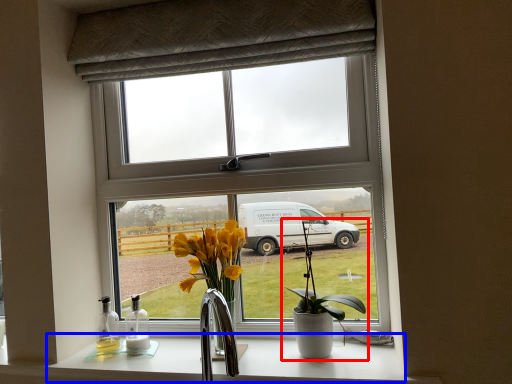
Question: Which point is further to the camera, houseplant (highlighted by a red box) or counter top (highlighted by a blue box)?

Choices:
 (A) houseplant
 (B) counter top

Answer: (A)